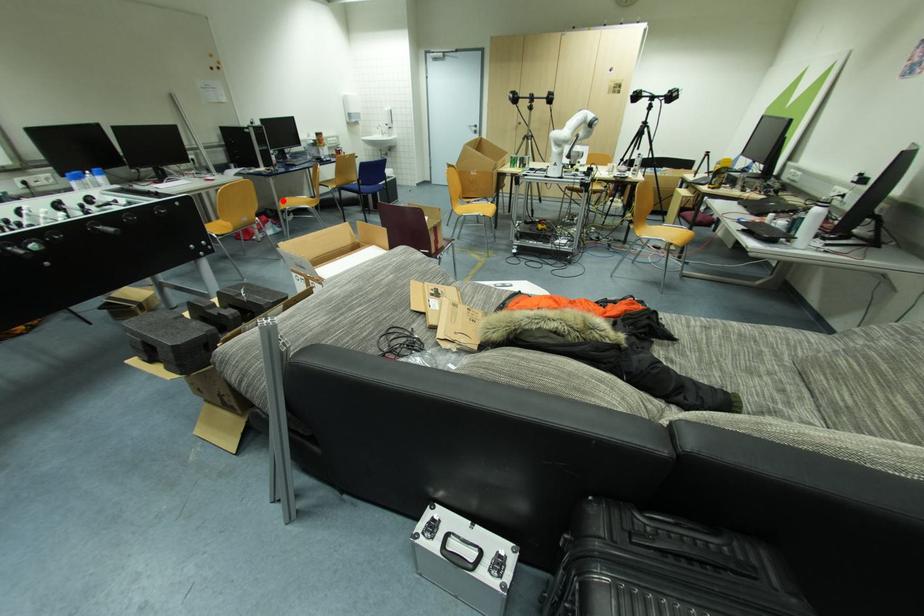
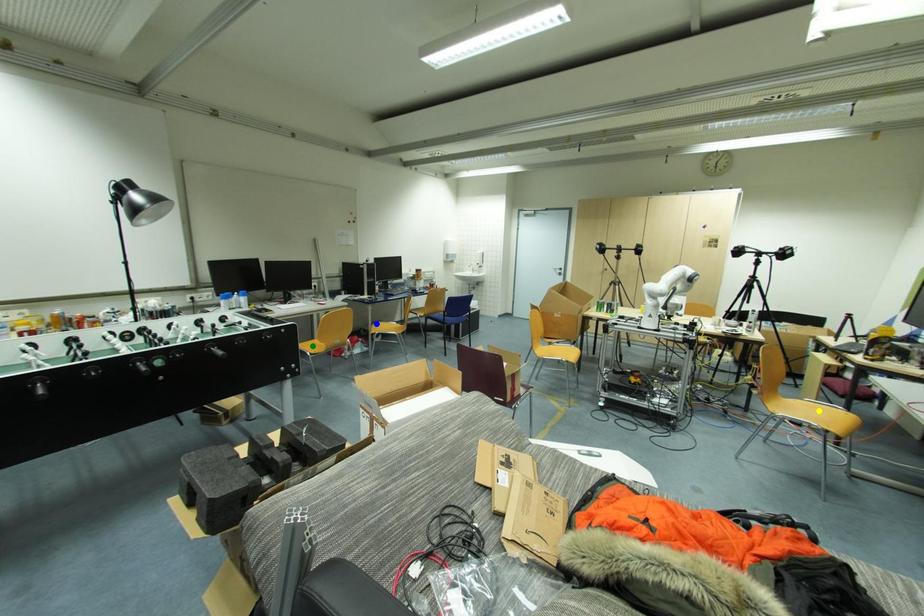
Question: I am providing you with two images of the same scene from different viewpoints. A red point is marked on the first image. You are given multiple points on the second image. In image 2, which mark is for the same physical point as the one in image 1?

Choices:
 (A) blue point
 (B) green point
 (C) yellow point

Answer: (A)